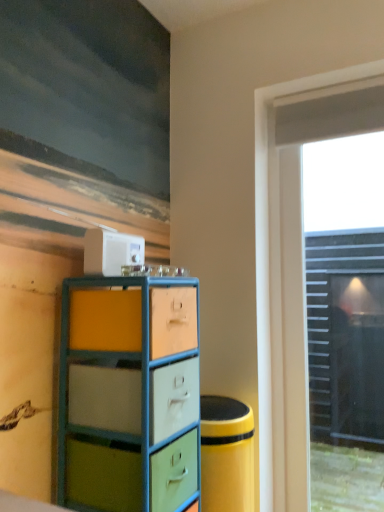
Question: Considering the positions of matte painted wood chest of drawers at center and transparent glass door at right in the image, is matte painted wood chest of drawers at center wider or thinner than transparent glass door at right?

Choices:
 (A) wide
 (B) thin

Answer: (A)

Question: In terms of size, does matte painted wood chest of drawers at center appear bigger or smaller than transparent glass door at right?

Choices:
 (A) small
 (B) big

Answer: (B)

Question: Estimate the real-world distances between objects in this image. Which object is closer to the transparent glass door at right?

Choices:
 (A) matte painted wood chest of drawers at center
 (B) white plastic toaster at upper center

Answer: (A)

Question: Which is nearer to the white plastic toaster at upper center?

Choices:
 (A) matte painted wood chest of drawers at center
 (B) transparent glass door at right

Answer: (A)